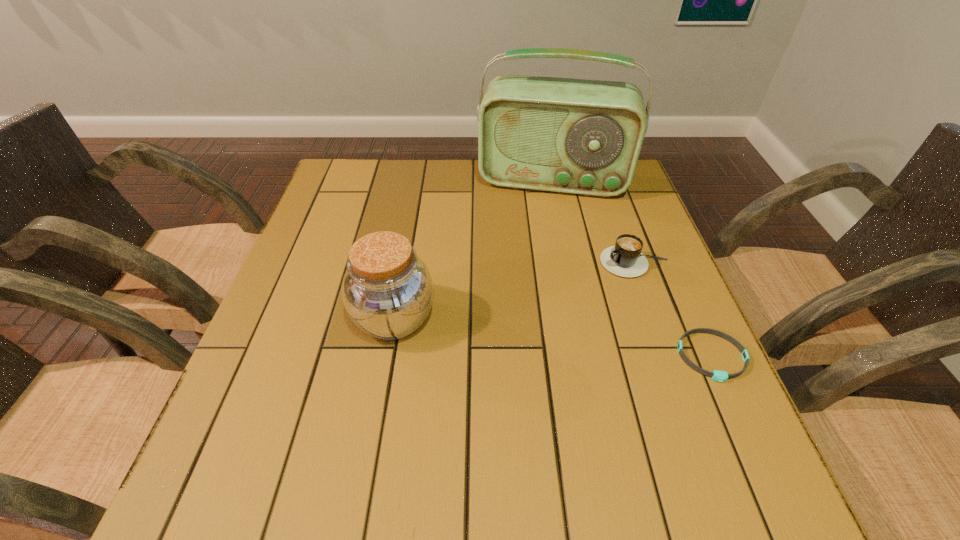
Where is `vacant space located 0.200m with the handle on the side of the second farthest object`? Image resolution: width=960 pixels, height=540 pixels. vacant space located 0.200m with the handle on the side of the second farthest object is located at coordinates (541, 307).

Find the location of `blank space located 0.090m with the handle on the side of the second farthest object`. blank space located 0.090m with the handle on the side of the second farthest object is located at coordinates (580, 287).

This screenshot has width=960, height=540. Identify the location of vacant space situated 0.150m on the front panel of the radio receiver. (539, 236).

I want to click on free space located on the front panel of the radio receiver, so click(x=534, y=274).

You are a GUI agent. You are given a task and a screenshot of the screen. Output one action in this format:
    pyautogui.click(x=<x>, y=<y>)
    Task: Click on the free space located on the front panel of the radio receiver
    
    Given the screenshot: What is the action you would take?
    pyautogui.click(x=530, y=302)

What are the coordinates of `object positioned at the far edge` in the screenshot? It's located at pyautogui.click(x=578, y=136).

I want to click on wristband located at the right edge, so click(x=721, y=376).

The width and height of the screenshot is (960, 540). Identify the location of cappuccino located in the right edge section of the desktop. (625, 259).

This screenshot has height=540, width=960. Identify the location of radio receiver that is at the right edge. (578, 136).

Image resolution: width=960 pixels, height=540 pixels. I want to click on object located at the far right corner, so click(578, 136).